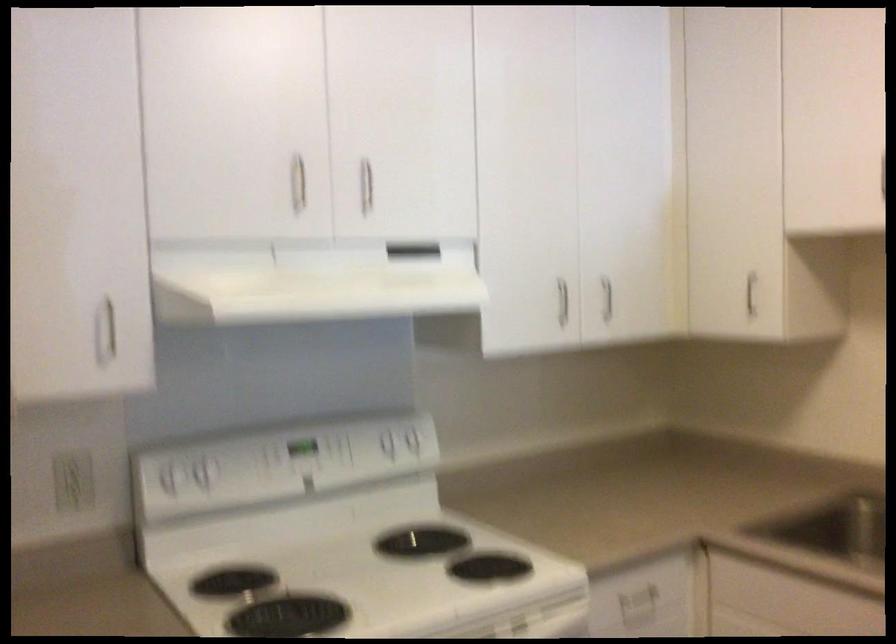
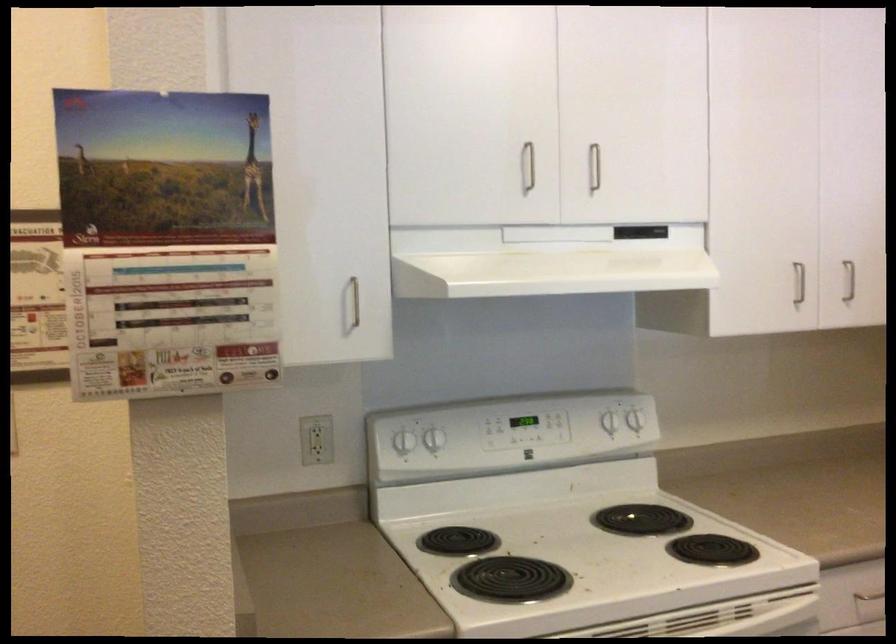
Where in the second image is the point corresponding to (389,444) from the first image?

(608, 422)